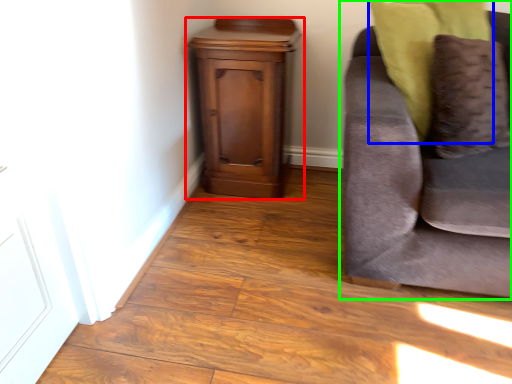
Question: Estimate the real-world distances between objects in this image. Which object is closer to nightstand (highlighted by a red box), pillow (highlighted by a blue box) or studio couch (highlighted by a green box)?

Choices:
 (A) pillow
 (B) studio couch

Answer: (A)